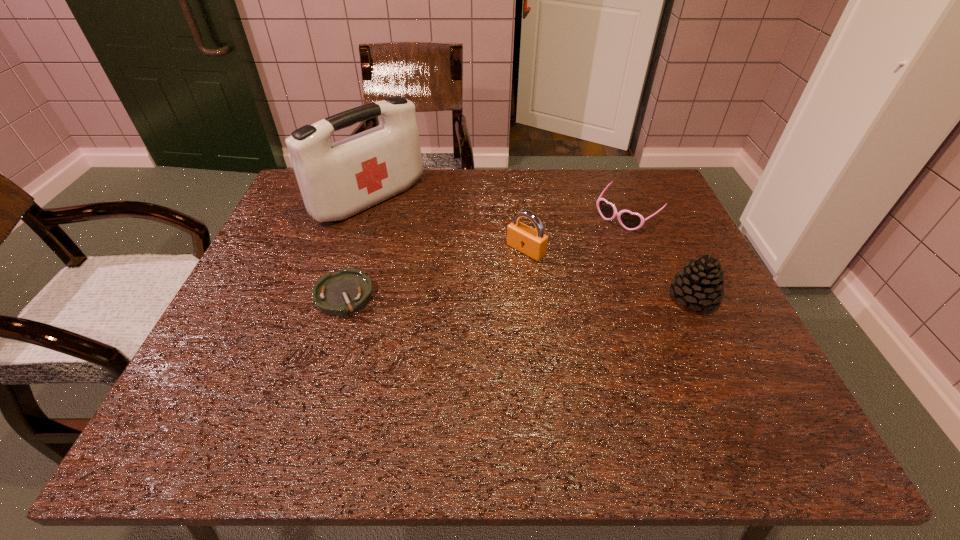
Identify the location of the shortest object. Image resolution: width=960 pixels, height=540 pixels. (341, 293).

Identify the location of pinecone. (700, 284).

Where is `padlock`? This screenshot has height=540, width=960. padlock is located at coordinates 533,243.

Where is `the third farthest object`? The height and width of the screenshot is (540, 960). the third farthest object is located at coordinates (533, 243).

The width and height of the screenshot is (960, 540). In order to click on the first-aid kit in this screenshot , I will do `click(337, 180)`.

Find the location of `sunglasses`. sunglasses is located at coordinates (629, 220).

This screenshot has width=960, height=540. I want to click on vacant region located on the back of the ashtray, so click(x=372, y=203).

Identify the location of vacant space located 0.230m at the narrow end of the pinecone. (569, 298).

This screenshot has width=960, height=540. What are the coordinates of `vacant space located 0.380m at the narrow end of the pinecone` in the screenshot? It's located at (504, 298).

Identify the location of vacant space located at the narrow end of the pinecone. The image size is (960, 540). (543, 298).